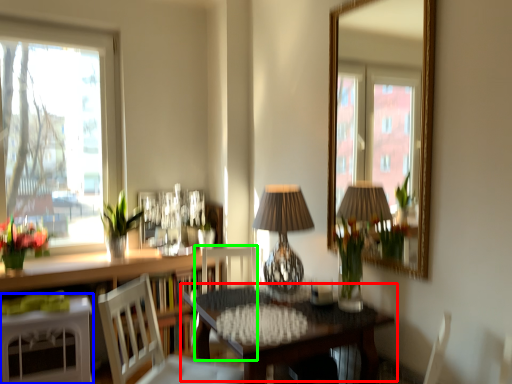
Question: Considering the real-world distances, which object is farthest from table (highlighted by a red box)? table (highlighted by a blue box) or chair (highlighted by a green box)?

Choices:
 (A) table
 (B) chair

Answer: (A)